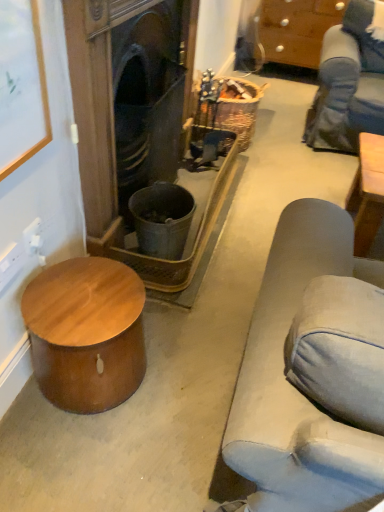
In order to click on vacant area to the right of wooden drum at lower left in this screenshot , I will do `click(182, 382)`.